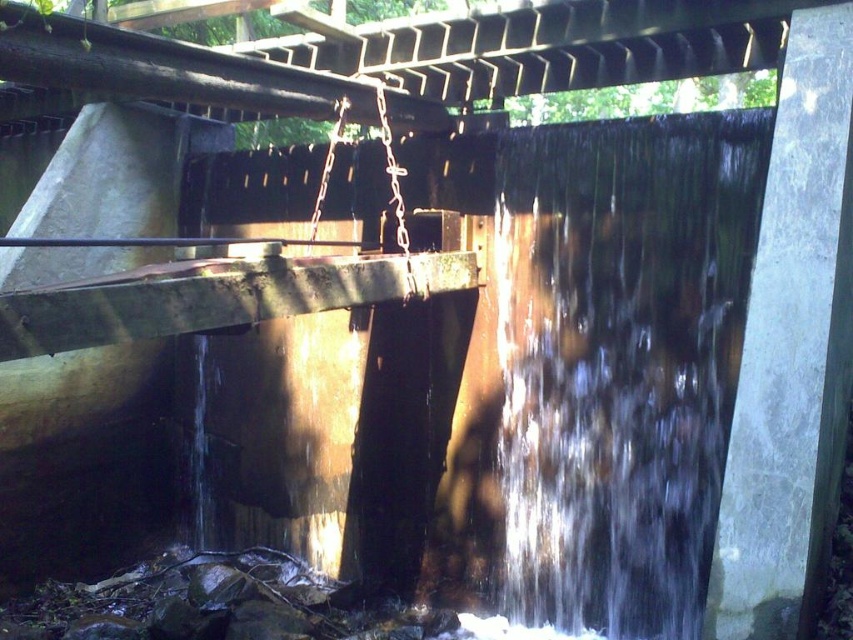
Question: Which point appears closest to the camera in this image?

Choices:
 (A) (62, 58)
 (B) (729, 262)

Answer: (A)

Question: In this image, where is clear water at center located relative to rusty metal beam at center?

Choices:
 (A) right
 (B) left

Answer: (A)

Question: Can you confirm if clear water at center is positioned to the left of rusty metal beam at center?

Choices:
 (A) yes
 (B) no

Answer: (B)

Question: Which of these objects is positioned closest to the rusty metal beam at center?

Choices:
 (A) clear water at center
 (B) rusty metal beam at upper center

Answer: (B)

Question: Estimate the real-world distances between objects in this image. Which object is closer to the rusty metal beam at upper center?

Choices:
 (A) clear water at center
 (B) rusty metal beam at center

Answer: (B)

Question: Is clear water at center positioned in front of rusty metal beam at upper center?

Choices:
 (A) yes
 (B) no

Answer: (B)